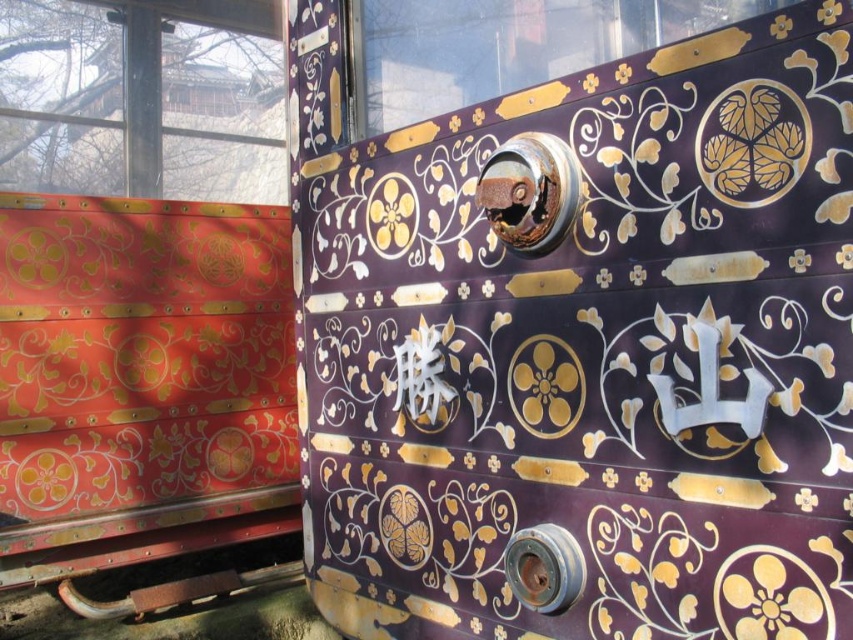
Can you confirm if transparent glass window at upper left is positioned below glossy glass window at upper center?

No.

Consider the image. Can you confirm if transparent glass window at upper left is bigger than glossy glass window at upper center?

Correct, transparent glass window at upper left is larger in size than glossy glass window at upper center.

In order to click on transparent glass window at upper left in this screenshot , I will do `click(142, 99)`.

Is purple lacquered door at center wider than transparent glass window at upper left?

No, purple lacquered door at center is not wider than transparent glass window at upper left.

Between purple lacquered door at center and transparent glass window at upper left, which one has less height?

Standing shorter between the two is transparent glass window at upper left.

Is point (535, 115) closer to viewer compared to point (3, 157)?

Yes, it is in front of point (3, 157).

Image resolution: width=853 pixels, height=640 pixels. What are the coordinates of `purple lacquered door at center` in the screenshot? It's located at (581, 342).

Does purple lacquered door at center appear over glossy glass window at upper center?

No.

What do you see at coordinates (581, 342) in the screenshot? I see `purple lacquered door at center` at bounding box center [581, 342].

What are the coordinates of `purple lacquered door at center` in the screenshot? It's located at (581, 342).